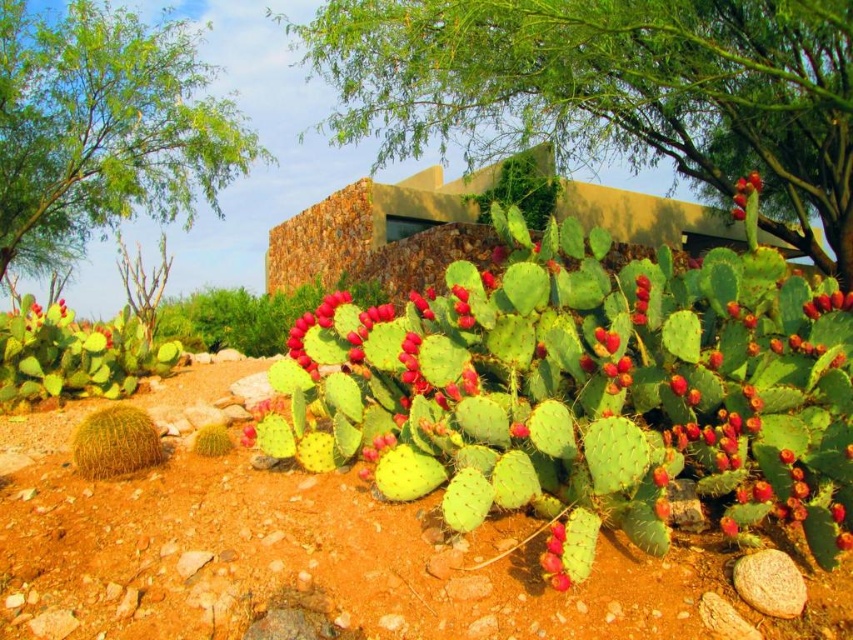
Between green leafy tree at upper left and red matte prickly pear cactus at lower center, which one has more height?

With more height is green leafy tree at upper left.

Between green leafy tree at upper left and red matte prickly pear cactus at lower center, which one is positioned higher?

green leafy tree at upper left is above.

The width and height of the screenshot is (853, 640). In order to click on green leafy tree at upper left in this screenshot , I will do `click(103, 129)`.

This screenshot has width=853, height=640. In order to click on green leafy tree at upper left in this screenshot , I will do `click(103, 129)`.

Can you confirm if green spiny cactus at lower left is wider than glossy red prickly pear cactus at upper right?

Incorrect, green spiny cactus at lower left's width does not surpass glossy red prickly pear cactus at upper right's.

Is point (73, 323) closer to camera compared to point (744, 198)?

No.

Where is `green spiny cactus at lower left`? green spiny cactus at lower left is located at coordinates (74, 355).

Does red matte prickly pear cactus at lower center have a greater height compared to red matte prickly pear cactus at center?

Indeed, red matte prickly pear cactus at lower center has a greater height compared to red matte prickly pear cactus at center.

Is point (544, 563) closer to camera compared to point (842, 301)?

Yes.

The width and height of the screenshot is (853, 640). In order to click on red matte prickly pear cactus at lower center in this screenshot , I will do `click(554, 557)`.